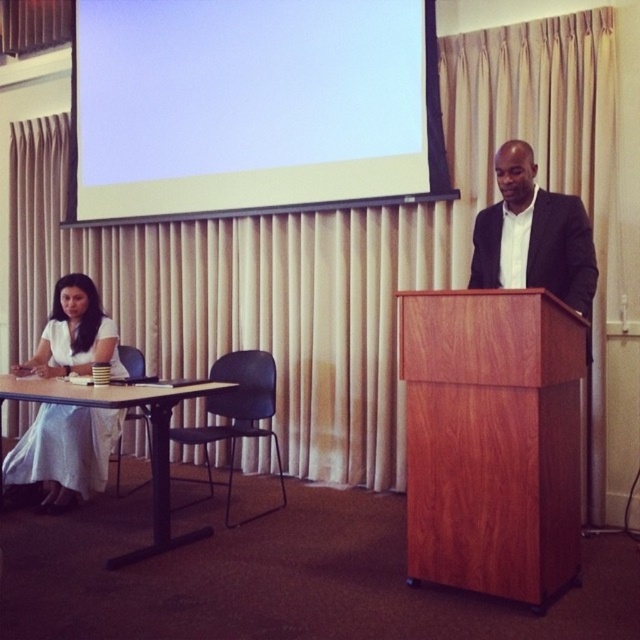
Which is below, cherry wood podium at center or white cotton dress at lower left?

cherry wood podium at center

Is cherry wood podium at center wider than white cotton dress at lower left?

Yes, cherry wood podium at center is wider than white cotton dress at lower left.

Where is `cherry wood podium at center`? The width and height of the screenshot is (640, 640). cherry wood podium at center is located at coordinates (492, 440).

Identify the location of cherry wood podium at center. (492, 440).

What do you see at coordinates (536, 234) in the screenshot?
I see `matte black suit at center` at bounding box center [536, 234].

Between point (529, 278) and point (429, 104), which one is positioned in front?

Positioned in front is point (529, 278).

In order to click on matte black suit at center in this screenshot , I will do `click(536, 234)`.

Does cherry wood podium at center appear under wooden table at lower left?

Correct, cherry wood podium at center is located below wooden table at lower left.

Is cherry wood podium at center to the right of wooden table at lower left from the viewer's perspective?

Yes, cherry wood podium at center is to the right of wooden table at lower left.

Identify the location of cherry wood podium at center. This screenshot has width=640, height=640. (492, 440).

Identify the location of cherry wood podium at center. The height and width of the screenshot is (640, 640). (492, 440).